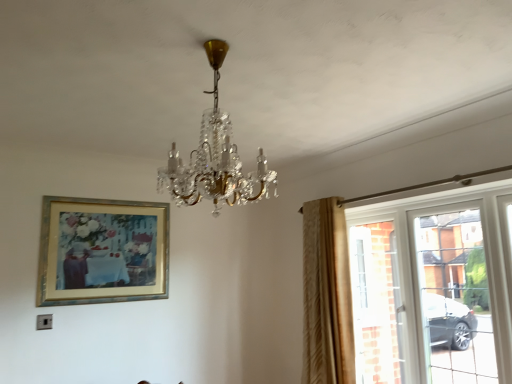
Question: Considering the positions of clear glass window at right and crystal glass chandelier at center in the image, is clear glass window at right wider or thinner than crystal glass chandelier at center?

Choices:
 (A) thin
 (B) wide

Answer: (A)

Question: From a real-world perspective, is clear glass window at right physically located above or below crystal glass chandelier at center?

Choices:
 (A) above
 (B) below

Answer: (B)

Question: Which object is positioned farthest from the gold metallic picture frame at upper left?

Choices:
 (A) beige textured curtain at right
 (B) crystal glass chandelier at center
 (C) clear glass window at right

Answer: (C)

Question: Considering the real-world distances, which object is closest to the crystal glass chandelier at center?

Choices:
 (A) beige textured curtain at right
 (B) clear glass window at right
 (C) gold metallic picture frame at upper left

Answer: (A)